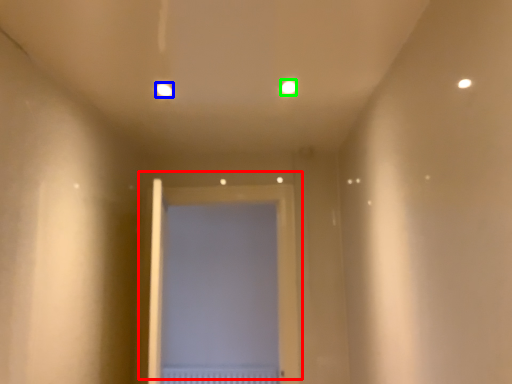
Question: Which is farther away from door (highlighted by a red box)? light (highlighted by a blue box) or light (highlighted by a green box)?

Choices:
 (A) light
 (B) light

Answer: (A)